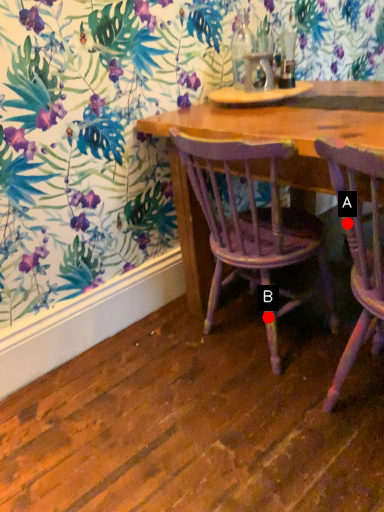
Question: Two points are circled on the image, labeled by A and B beside each circle. Among these points, which one is nearest to the camera?

Choices:
 (A) A is closer
 (B) B is closer

Answer: (A)